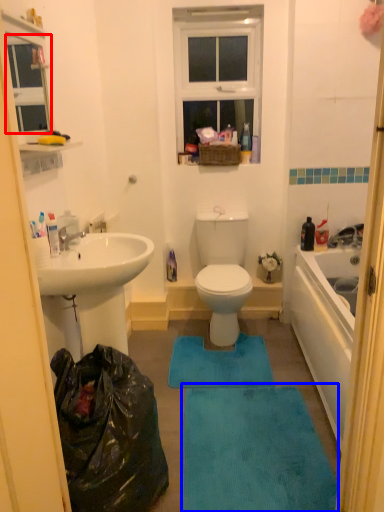
Question: Which object appears closest to the camera in this image, window screen (highlighted by a red box) or bath mat (highlighted by a blue box)?

Choices:
 (A) window screen
 (B) bath mat

Answer: (A)